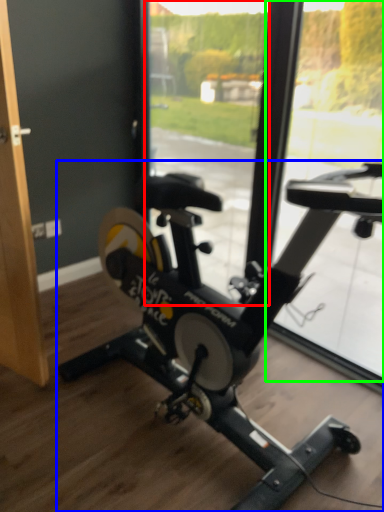
Question: Which is farther away from window screen (highlighted by a red box)? stationary bicycle (highlighted by a blue box) or window screen (highlighted by a green box)?

Choices:
 (A) stationary bicycle
 (B) window screen

Answer: (A)